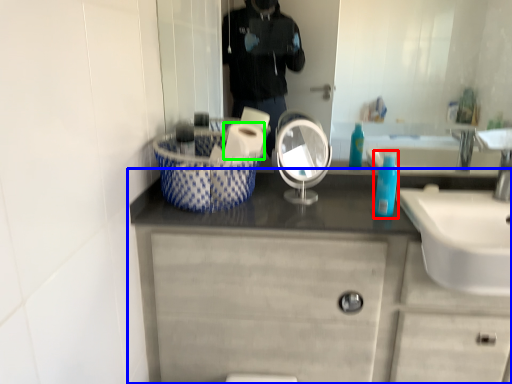
Question: Considering the real-world distances, which object is closest to mouthwash (highlighted by a red box)? bathroom cabinet (highlighted by a blue box) or toilet paper (highlighted by a green box).

Choices:
 (A) bathroom cabinet
 (B) toilet paper

Answer: (B)